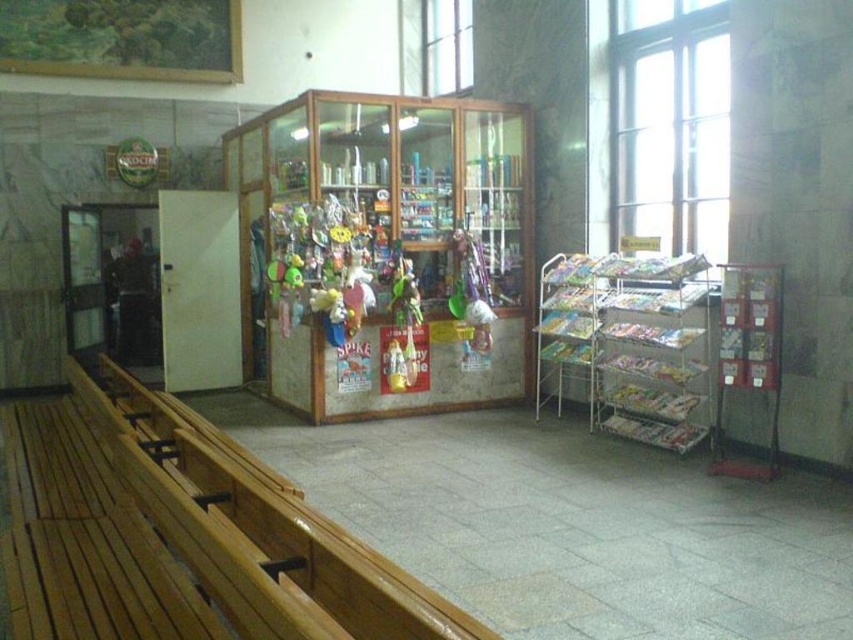
Question: Where is wooden bench at left located in relation to shiny plastic action figure at center in the image?

Choices:
 (A) left
 (B) right

Answer: (A)

Question: Considering the relative positions of wooden bench at left and shiny plastic action figure at center in the image provided, where is wooden bench at left located with respect to shiny plastic action figure at center?

Choices:
 (A) above
 (B) below

Answer: (B)

Question: Which object is closer to the camera taking this photo?

Choices:
 (A) wooden bench at left
 (B) shiny plastic action figure at center

Answer: (A)

Question: Which of the following is the closest to the observer?

Choices:
 (A) shiny plastic action figure at center
 (B) wooden bench at left

Answer: (B)

Question: Is the position of wooden bench at left less distant than that of shiny plastic action figure at center?

Choices:
 (A) yes
 (B) no

Answer: (A)